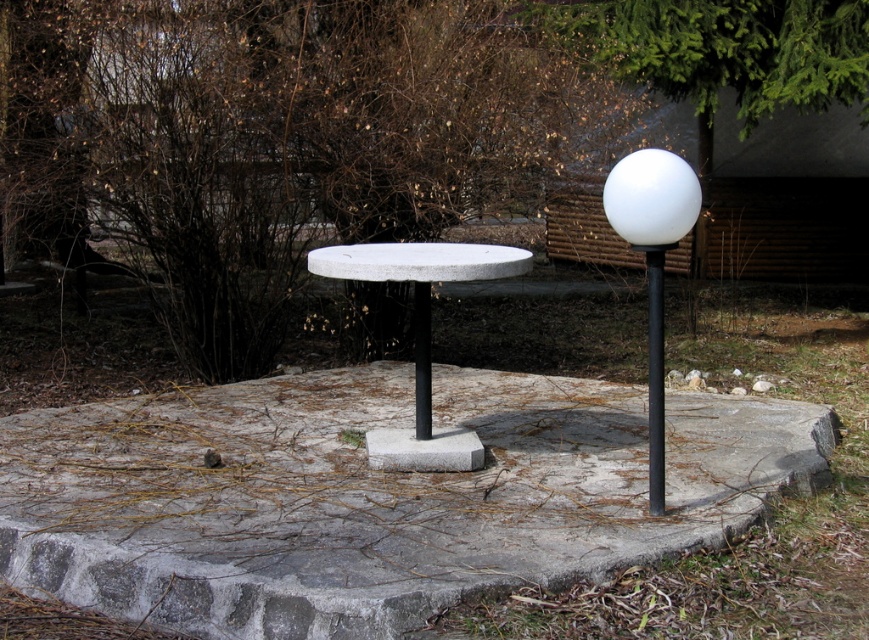
Question: Does white concrete table at center have a greater width compared to black metal pole at right?

Choices:
 (A) yes
 (B) no

Answer: (B)

Question: Which object is the closest to the gray concrete at center?

Choices:
 (A) black metal pole at right
 (B) white concrete table at center

Answer: (B)

Question: Which point is closer to the camera taking this photo?

Choices:
 (A) (419, 385)
 (B) (657, 300)

Answer: (A)

Question: Does white glossy ball at upper right come in front of black metal pole at right?

Choices:
 (A) no
 (B) yes

Answer: (B)

Question: Does white glossy ball at upper right appear on the right side of black polished pole at center?

Choices:
 (A) no
 (B) yes

Answer: (B)

Question: Which point is closer to the camera?

Choices:
 (A) black metal pole at right
 (B) white concrete table at center
 (C) black polished pole at center

Answer: (A)